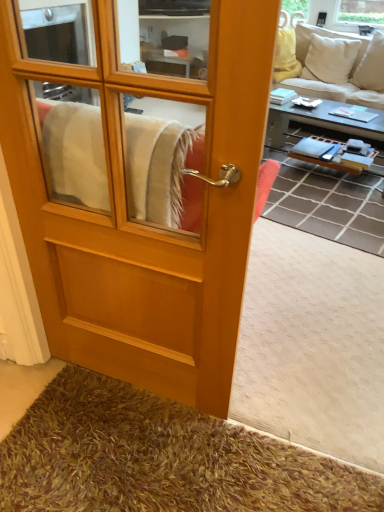
Question: Considering the relative positions of wooden door at center and brown shaggy carpet at center in the image provided, is wooden door at center to the left or to the right of brown shaggy carpet at center?

Choices:
 (A) left
 (B) right

Answer: (A)

Question: Looking at the image, does wooden door at center seem bigger or smaller compared to brown shaggy carpet at center?

Choices:
 (A) big
 (B) small

Answer: (B)

Question: Which is farther from the brown shaggy carpet at center?

Choices:
 (A) beige fabric couch at upper right
 (B) wooden/textured coffee table at right
 (C) wooden door at center

Answer: (A)

Question: Which of these objects is positioned farthest from the brown shaggy carpet at center?

Choices:
 (A) wooden/textured coffee table at right
 (B) beige fabric couch at upper right
 (C) wooden door at center

Answer: (B)